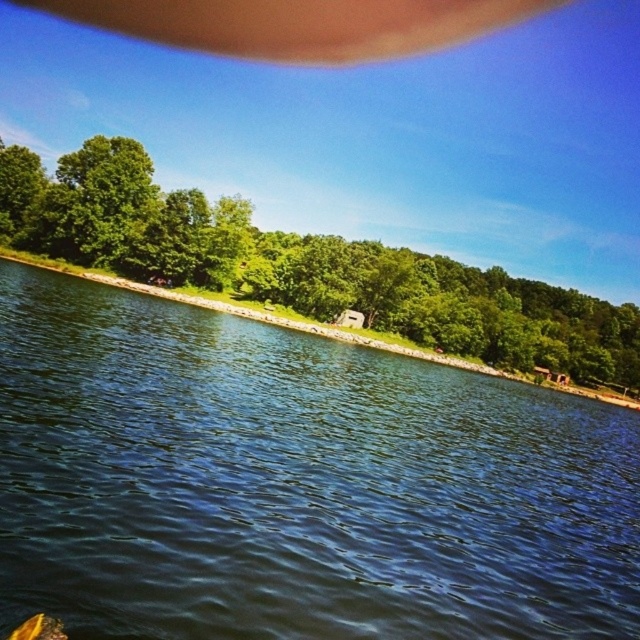
Question: Among these points, which one is nearest to the camera?

Choices:
 (A) (355, 588)
 (B) (177, 202)

Answer: (A)

Question: Can you confirm if blue water at center is positioned to the right of green leafy tree at center?

Choices:
 (A) yes
 (B) no

Answer: (B)

Question: Among these objects, which one is farthest from the camera?

Choices:
 (A) blue water at center
 (B) green leafy tree at center

Answer: (B)

Question: Is blue water at center closer to camera compared to green leafy tree at center?

Choices:
 (A) no
 (B) yes

Answer: (B)

Question: Can you confirm if blue water at center is positioned above green leafy tree at center?

Choices:
 (A) yes
 (B) no

Answer: (B)

Question: Which object is closer to the camera taking this photo?

Choices:
 (A) green leafy tree at center
 (B) blue water at center

Answer: (B)